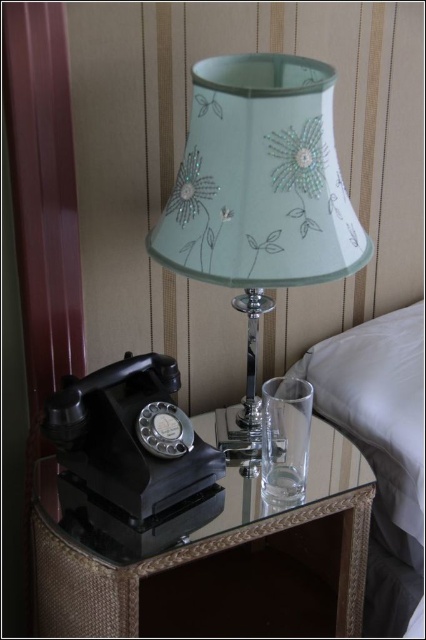
You are standing in the hotel room and want to place a small vase on the black glass table at lower left. Based on the coordinates provided, can you confirm if the point marked as point (204, 548) is the correct location for the table?

The black glass table at lower left is represented by point (204, 548), so yes, placing the vase at this coordinate will place it on the table.